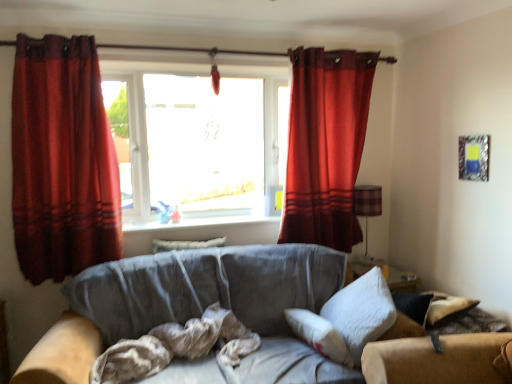
The image size is (512, 384). Find the location of `brown textured fabric at center`. brown textured fabric at center is located at coordinates (175, 347).

Locate an element on the screen. This screenshot has height=384, width=512. suede gray couch at center is located at coordinates (195, 293).

This screenshot has height=384, width=512. Find the location of `velvet-like beige pillow at center, the first pillow when ordered from back to front`. velvet-like beige pillow at center, the first pillow when ordered from back to front is located at coordinates (186, 244).

Where is `transparent glass window at center`? This screenshot has width=512, height=384. transparent glass window at center is located at coordinates [x=201, y=138].

The image size is (512, 384). In order to click on white fluffy pillow at right, arranged as the second pillow when viewed from the left in this screenshot , I will do `click(361, 311)`.

At what (x,y) coordinates should I click in order to perform the action: click on brown textured fabric at center. Please return your answer as a coordinate pair (x, y). The height and width of the screenshot is (384, 512). Looking at the image, I should click on (175, 347).

From a real-world perspective, which object stands above the other?

velvet red curtain at left, marked as the second curtain in a right-to-left arrangement.

Considering the points (228, 324) and (94, 136), which point is behind, point (228, 324) or point (94, 136)?

Positioned behind is point (94, 136).

From the image's perspective, is brown textured fabric at center located above or below velvet red curtain at left, marked as the second curtain in a right-to-left arrangement?

Clearly, from the image's perspective, brown textured fabric at center is below velvet red curtain at left, marked as the second curtain in a right-to-left arrangement.

Is brown textured fabric at center outside of velvet red curtain at left, the 1th curtain in the left-to-right sequence?

brown textured fabric at center is positioned outside velvet red curtain at left, the 1th curtain in the left-to-right sequence.

Considering the sizes of white fluffy pillow at right, positioned as the 2th pillow in back-to-front order, and velvet red curtain at left, which is the first curtain from front to back, in the image, is white fluffy pillow at right, positioned as the 2th pillow in back-to-front order, bigger or smaller than velvet red curtain at left, which is the first curtain from front to back,?

In the image, white fluffy pillow at right, positioned as the 2th pillow in back-to-front order, appears to be smaller than velvet red curtain at left, which is the first curtain from front to back.

Is white fluffy pillow at right, positioned as the 2th pillow in back-to-front order, situated inside velvet red curtain at left, which is the first curtain from front to back, or outside?

white fluffy pillow at right, positioned as the 2th pillow in back-to-front order, is located beyond the bounds of velvet red curtain at left, which is the first curtain from front to back.

How different are the orientations of white fluffy pillow at right, which appears as the first pillow when viewed from the front, and velvet red curtain at left, the 2th curtain viewed from the back, in degrees?

104 degrees.

Which is closer, (328, 317) or (48, 130)?

Point (328, 317).

Considering the relative sizes of metallic silver picture frame at upper right and brown textured fabric at center in the image provided, is metallic silver picture frame at upper right smaller than brown textured fabric at center?

Indeed, metallic silver picture frame at upper right has a smaller size compared to brown textured fabric at center.

Is point (461, 167) in front of point (116, 351)?

No, it is not.

Is metallic silver picture frame at upper right positioned beyond the bounds of brown textured fabric at center?

metallic silver picture frame at upper right is positioned outside brown textured fabric at center.

Looking at this image, can you confirm if brown textured fabric at center is positioned to the right of velvet red curtain at upper right, the first curtain positioned from the right?

In fact, brown textured fabric at center is to the left of velvet red curtain at upper right, the first curtain positioned from the right.

Where is `material that is on the left side of velvet red curtain at upper right, acting as the 2th curtain starting from the front`? material that is on the left side of velvet red curtain at upper right, acting as the 2th curtain starting from the front is located at coordinates (175, 347).

Based on the photo, considering the sizes of objects brown textured fabric at center and velvet red curtain at upper right, acting as the 2th curtain starting from the front, in the image provided, who is smaller, brown textured fabric at center or velvet red curtain at upper right, acting as the 2th curtain starting from the front,?

brown textured fabric at center is smaller.

Can you confirm if velvet red curtain at upper right, the second curtain when ordered from left to right, is shorter than white glossy window sill at center?

No, velvet red curtain at upper right, the second curtain when ordered from left to right, is not shorter than white glossy window sill at center.

Which object is thinner, velvet red curtain at upper right, acting as the 2th curtain starting from the front, or white glossy window sill at center?

With smaller width is velvet red curtain at upper right, acting as the 2th curtain starting from the front.

How distant is velvet red curtain at upper right, the first curtain positioned from the right, from white glossy window sill at center?

A distance of 25.83 inches exists between velvet red curtain at upper right, the first curtain positioned from the right, and white glossy window sill at center.

From the image's perspective, is velvet red curtain at upper right, positioned as the first curtain in back-to-front order, located above or below white glossy window sill at center?

From the image's perspective, velvet red curtain at upper right, positioned as the first curtain in back-to-front order, appears above white glossy window sill at center.

Which is more to the right, metallic silver picture frame at upper right or transparent glass window at center?

metallic silver picture frame at upper right.

Which of these two, metallic silver picture frame at upper right or transparent glass window at center, is bigger?

transparent glass window at center.

Who is taller, metallic silver picture frame at upper right or transparent glass window at center?

With more height is transparent glass window at center.

Is metallic silver picture frame at upper right not close to transparent glass window at center?

Yes.

From the picture: Is suede gray couch at center spatially inside metallic silver picture frame at upper right, or outside of it?

suede gray couch at center lies outside metallic silver picture frame at upper right.

Is suede gray couch at center wider or thinner than metallic silver picture frame at upper right?

Considering their sizes, suede gray couch at center looks broader than metallic silver picture frame at upper right.

Is suede gray couch at center taller or shorter than metallic silver picture frame at upper right?

Considering their sizes, suede gray couch at center has more height than metallic silver picture frame at upper right.

From a real-world perspective, between suede gray couch at center and metallic silver picture frame at upper right, who is vertically lower?

In real-world perspective, suede gray couch at center is lower.

This screenshot has height=384, width=512. Identify the location of curtain that is the 1st object located above the brown textured fabric at center (from the image's perspective). (62, 160).

The width and height of the screenshot is (512, 384). Find the location of `the 2nd curtain counting from the left side of the white fluffy pillow at right, placed as the first pillow when sorted from right to left`. the 2nd curtain counting from the left side of the white fluffy pillow at right, placed as the first pillow when sorted from right to left is located at coordinates (62, 160).

Estimate the real-world distances between objects in this image. Which object is further from metallic silver picture frame at upper right, transparent glass window at center or brown textured fabric at center?

brown textured fabric at center lies further to metallic silver picture frame at upper right than the other object.

From the image, which object appears to be nearer to suede gray couch at center, velvet red curtain at upper right, acting as the 2th curtain starting from the front, or white glossy window sill at center?

white glossy window sill at center is positioned closer to the anchor suede gray couch at center.

From the image, which object appears to be nearer to velvet red curtain at left, the 2th curtain viewed from the back, metallic silver picture frame at upper right or transparent glass window at center?

transparent glass window at center is closer to velvet red curtain at left, the 2th curtain viewed from the back.

Looking at this image, looking at the image, which one is located closer to white glossy window sill at center, plaid fabric lampshade at right or velvet red curtain at left, marked as the second curtain in a right-to-left arrangement?

The object closer to white glossy window sill at center is velvet red curtain at left, marked as the second curtain in a right-to-left arrangement.

Estimate the real-world distances between objects in this image. Which object is further from white glossy window sill at center, metallic silver picture frame at upper right or plaid fabric lampshade at right?

metallic silver picture frame at upper right is further to white glossy window sill at center.

Estimate the real-world distances between objects in this image. Which object is further from white fluffy pillow at right, positioned as the 2th pillow in back-to-front order, plaid fabric lampshade at right or velvet red curtain at left, the 2th curtain viewed from the back?

velvet red curtain at left, the 2th curtain viewed from the back, lies further to white fluffy pillow at right, positioned as the 2th pillow in back-to-front order, than the other object.

Considering their positions, is plaid fabric lampshade at right positioned closer to metallic silver picture frame at upper right than white fluffy pillow at right, which appears as the first pillow when viewed from the front?

The object closer to metallic silver picture frame at upper right is plaid fabric lampshade at right.

Based on their spatial positions, is velvet red curtain at left, which is the first curtain from front to back, or white glossy window sill at center closer to metallic silver picture frame at upper right?

Among the two, white glossy window sill at center is located nearer to metallic silver picture frame at upper right.

The image size is (512, 384). What are the coordinates of `window positioned between suede gray couch at center and plaid fabric lampshade at right from near to far` in the screenshot? It's located at (201, 138).

At what (x,y) coordinates should I click in order to perform the action: click on window between suede gray couch at center and white glossy window sill at center in the front-back direction. Please return your answer as a coordinate pair (x, y). The width and height of the screenshot is (512, 384). Looking at the image, I should click on (201, 138).

What are the coordinates of `lamp situated between velvet red curtain at upper right, the second curtain when ordered from left to right, and metallic silver picture frame at upper right from left to right` in the screenshot? It's located at (367, 210).

You are a GUI agent. You are given a task and a screenshot of the screen. Output one action in this format:
    pyautogui.click(x=<x>, y=<y>)
    Task: Click on the pillow between transparent glass window at center and metallic silver picture frame at upper right
    The image size is (512, 384).
    Given the screenshot: What is the action you would take?
    pyautogui.click(x=361, y=311)